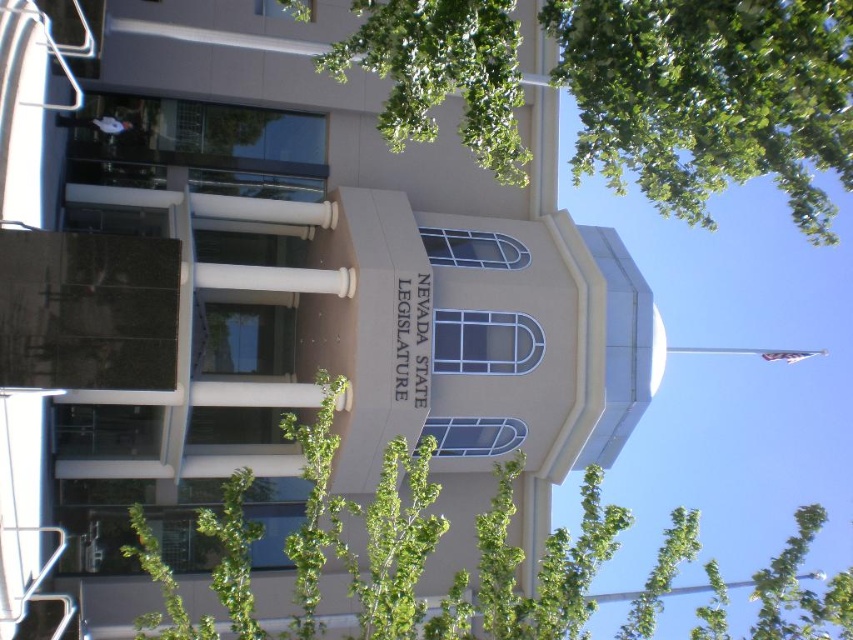
Identify the location of green leafy tree at upper center. This screenshot has height=640, width=853. (709, 97).

Is point (717, 52) positioned before point (715, 588)?

Yes.

Where is `green leafy tree at upper center`? The height and width of the screenshot is (640, 853). green leafy tree at upper center is located at coordinates (709, 97).

Identify the location of green leafy tree at upper center. This screenshot has height=640, width=853. (709, 97).